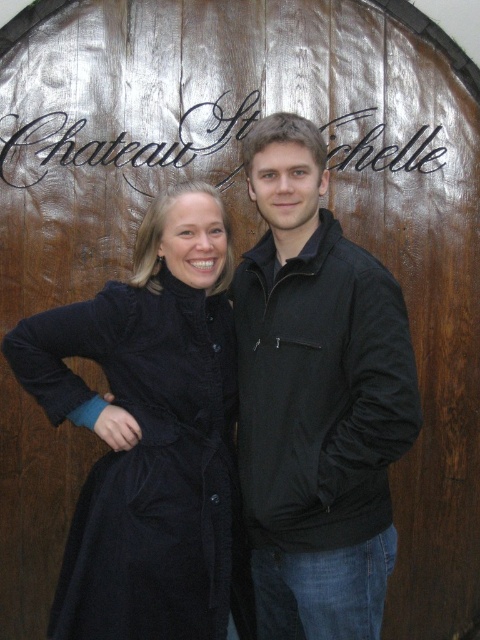
Is black matte jacket at center further to camera compared to velvet black coat at left?

Yes, black matte jacket at center is behind velvet black coat at left.

Is black matte jacket at center taller than velvet black coat at left?

Indeed, black matte jacket at center has a greater height compared to velvet black coat at left.

Between point (240, 352) and point (35, 355), which one is positioned behind?

The point (240, 352) is behind.

This screenshot has height=640, width=480. I want to click on black matte jacket at center, so click(316, 397).